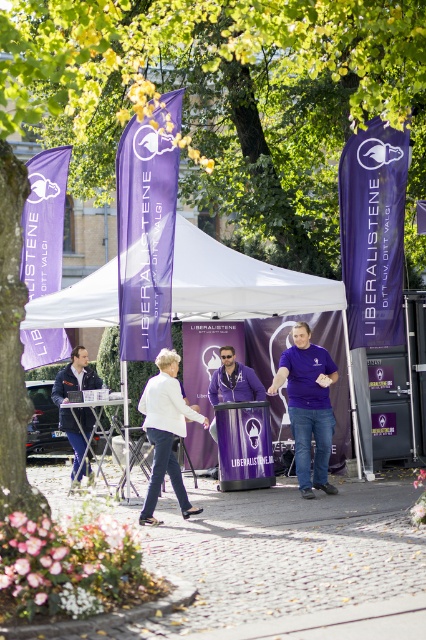
Does white fabric canopy at center have a greater height compared to dark blue jacket at left?

No.

Can you confirm if white fabric canopy at center is positioned above dark blue jacket at left?

Yes.

Is point (249, 305) farther from viewer compared to point (72, 476)?

No, (249, 305) is in front of (72, 476).

Where is `white fabric canopy at center`? Image resolution: width=426 pixels, height=640 pixels. white fabric canopy at center is located at coordinates (239, 282).

Can you confirm if white fabric pants at center is wider than purple matte jacket at center?

Incorrect, white fabric pants at center's width does not surpass purple matte jacket at center's.

In the scene shown: Is white fabric pants at center below purple matte jacket at center?

Yes.

Describe the element at coordinates (166, 432) in the screenshot. The width and height of the screenshot is (426, 640). I see `white fabric pants at center` at that location.

Where is `white fabric pants at center`? white fabric pants at center is located at coordinates (166, 432).

Which of these two, white fabric tent at center or purple matte jacket at center, stands taller?

purple matte jacket at center is taller.

Does white fabric tent at center have a smaller size compared to purple matte jacket at center?

Actually, white fabric tent at center might be larger than purple matte jacket at center.

Does point (333, 280) come behind point (232, 372)?

Yes, it is behind point (232, 372).

Identify the location of white fabric tent at center. (247, 291).